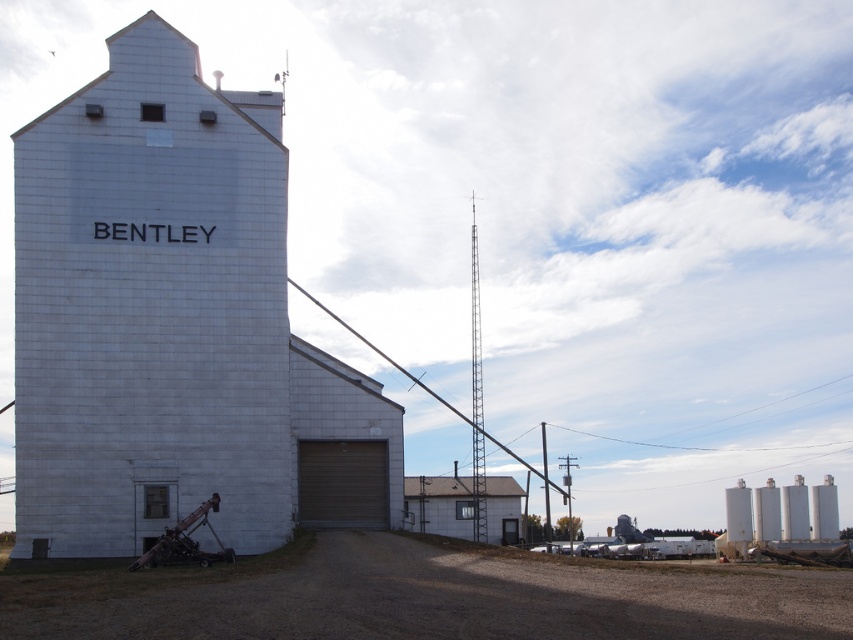
Is point (161, 92) farther from camera compared to point (517, 499)?

No, it is not.

Between white concrete grain silo at center and gray metal building at center, which one is positioned higher?

white concrete grain silo at center

Locate an element on the screen. This screenshot has height=640, width=853. white concrete grain silo at center is located at coordinates (173, 324).